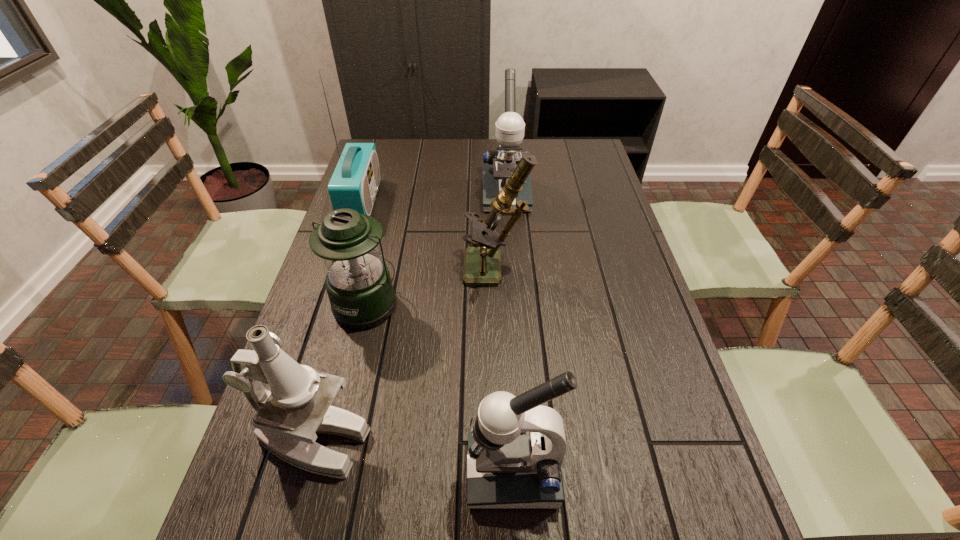
Find the location of a particular element. vacant point located 0.200m on the back of the leftmost microscope is located at coordinates click(343, 334).

The width and height of the screenshot is (960, 540). In order to click on vacant space located 0.390m on the right of the lantern in this screenshot , I will do `click(547, 303)`.

The height and width of the screenshot is (540, 960). In order to click on radio receiver positioned at the left edge in this screenshot , I will do `click(354, 184)`.

This screenshot has height=540, width=960. In order to click on microscope that is at the left edge in this screenshot , I will do `click(298, 407)`.

Find the location of a particular element. lantern located at the left edge is located at coordinates pos(358,283).

Identify the location of vacant space at the far edge of the desktop. (444, 150).

Identify the location of free spot at the left edge of the desktop. The image size is (960, 540). (273, 489).

Find the location of a particular element. The width and height of the screenshot is (960, 540). free space at the right edge is located at coordinates (602, 190).

I want to click on free space at the far left corner, so click(x=381, y=157).

I want to click on unoccupied position between the third nearest microscope and the radio receiver, so click(428, 237).